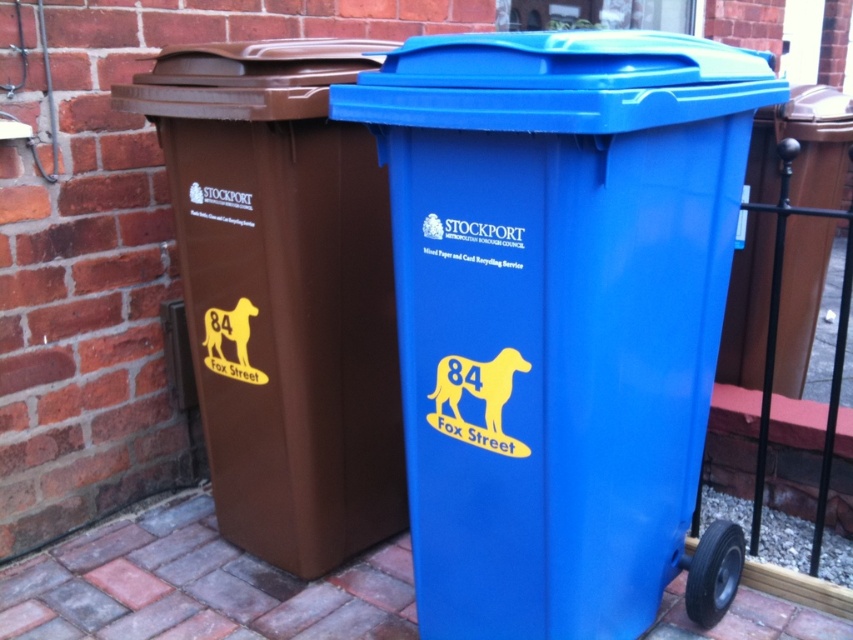
You are a delivery person trying to place a package between the brown matte plastic recycling bin at left and the blue plastic bin at right. Can you fit the package between them if the package is 1 meter long?

The brown matte plastic recycling bin at left is in front of the blue plastic bin at right, so there is no space between them to fit a 1 meter long package.

You are standing in front of the two recycling bins on Fox Street. You need to place a piece of paper in the correct bin. The instructions say to put it in the bin located at point (196,586). Which bin should you use?

The brick pavement at lower left is located at point (196,586), so you should place the paper in the bin nearest to that point.